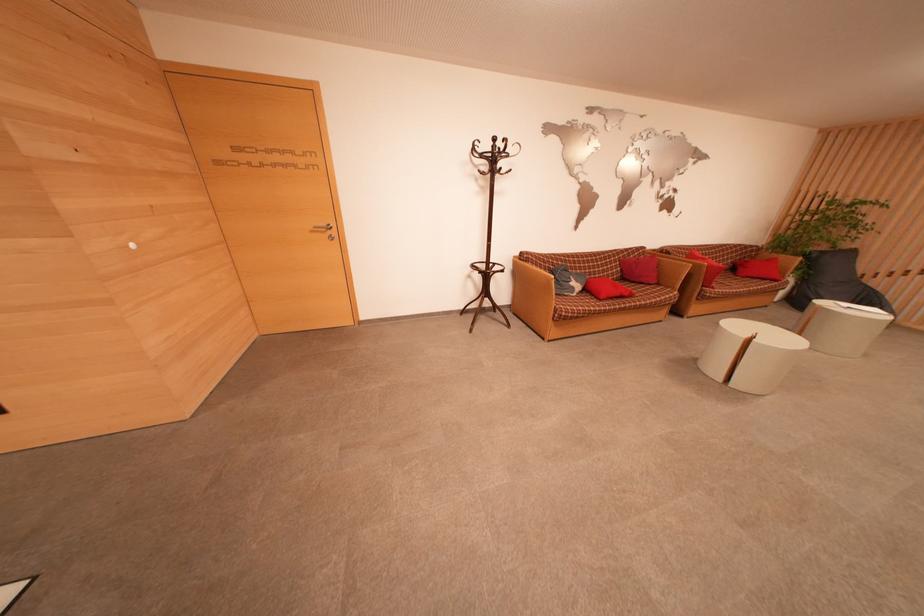
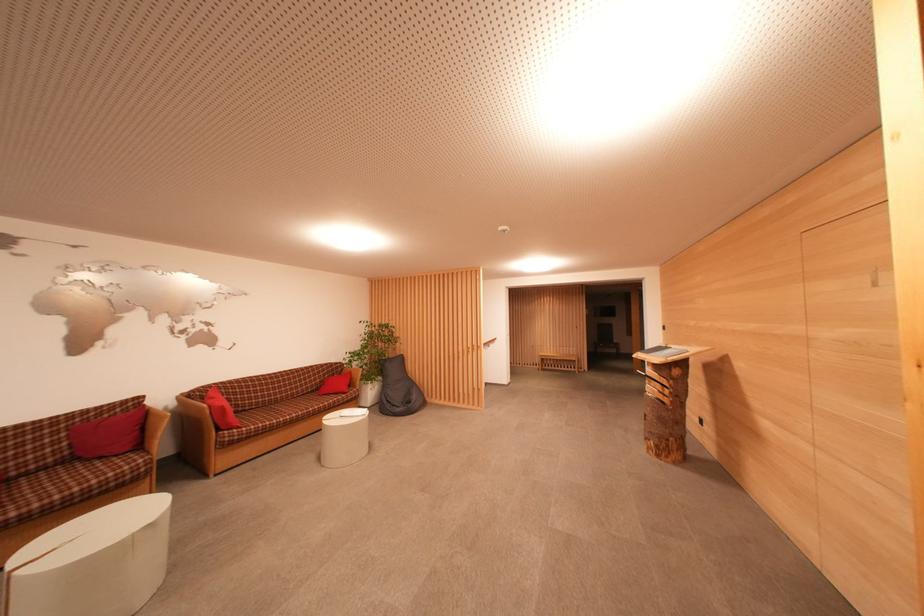
Find the pixel in the second image that matches pixel 850 249 in the first image.

(402, 357)